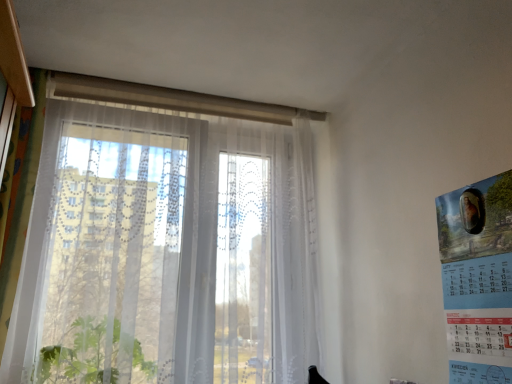
The width and height of the screenshot is (512, 384). Describe the element at coordinates (478, 279) in the screenshot. I see `blue paper calendar at right` at that location.

Where is `blue paper calendar at right`? The height and width of the screenshot is (384, 512). blue paper calendar at right is located at coordinates [x=478, y=279].

I want to click on transparent fabric window at center, so click(167, 251).

The height and width of the screenshot is (384, 512). What do you see at coordinates (167, 251) in the screenshot? I see `transparent fabric window at center` at bounding box center [167, 251].

Looking at this image, what is the approximate width of transparent fabric window at center?

transparent fabric window at center is 28.29 centimeters in width.

Locate an element on the screen. The height and width of the screenshot is (384, 512). blue paper calendar at right is located at coordinates (478, 279).

Considering the positions of objects blue paper calendar at right and transparent fabric window at center in the image provided, who is more to the right, blue paper calendar at right or transparent fabric window at center?

blue paper calendar at right.

Does blue paper calendar at right come in front of transparent fabric window at center?

That is True.

Is point (463, 354) positioned before point (150, 137)?

Yes.

From the image's perspective, between blue paper calendar at right and transparent fabric window at center, which one is located above?

transparent fabric window at center.

In the scene shown: From a real-world perspective, is blue paper calendar at right physically located above or below transparent fabric window at center?

Clearly, from a real-world perspective, blue paper calendar at right is below transparent fabric window at center.

Is blue paper calendar at right wider than transparent fabric window at center?

Incorrect, the width of blue paper calendar at right does not surpass that of transparent fabric window at center.

Considering the sizes of blue paper calendar at right and transparent fabric window at center in the image, is blue paper calendar at right taller or shorter than transparent fabric window at center?

Clearly, blue paper calendar at right is shorter compared to transparent fabric window at center.

Between blue paper calendar at right and transparent fabric window at center, which one has larger size?

With larger size is transparent fabric window at center.

Is blue paper calendar at right not within transparent fabric window at center?

blue paper calendar at right lies outside transparent fabric window at center's area.

Does blue paper calendar at right touch transparent fabric window at center?

No, blue paper calendar at right is not next to transparent fabric window at center.

Looking at this image, is blue paper calendar at right oriented towards transparent fabric window at center?

No, blue paper calendar at right does not turn towards transparent fabric window at center.

The width and height of the screenshot is (512, 384). I want to click on poster page below the transparent fabric window at center (from a real-world perspective), so 478,279.

Can you confirm if transparent fabric window at center is positioned to the right of blue paper calendar at right?

In fact, transparent fabric window at center is to the left of blue paper calendar at right.

Relative to blue paper calendar at right, is transparent fabric window at center in front or behind?

transparent fabric window at center is positioned farther from the viewer than blue paper calendar at right.

Which is behind, point (61, 101) or point (490, 327)?

The point (61, 101) is behind.

From the image's perspective, between transparent fabric window at center and blue paper calendar at right, who is located below?

blue paper calendar at right appears lower in the image.

Consider the image. From a real-world perspective, is transparent fabric window at center below blue paper calendar at right?

No, from a real-world perspective, transparent fabric window at center is not beneath blue paper calendar at right.

Which of these two, transparent fabric window at center or blue paper calendar at right, is wider?

transparent fabric window at center is wider.

From the picture: Is transparent fabric window at center taller or shorter than blue paper calendar at right?

Considering their sizes, transparent fabric window at center has more height than blue paper calendar at right.

Can you confirm if transparent fabric window at center is bigger than blue paper calendar at right?

Indeed, transparent fabric window at center has a larger size compared to blue paper calendar at right.

From the picture: Which is correct: transparent fabric window at center is inside blue paper calendar at right, or outside of it?

transparent fabric window at center is not enclosed by blue paper calendar at right.

Does transparent fabric window at center touch blue paper calendar at right?

No, transparent fabric window at center is not beside blue paper calendar at right.

Is transparent fabric window at center looking in the opposite direction of blue paper calendar at right?

transparent fabric window at center is not turned away from blue paper calendar at right.

How much distance is there between transparent fabric window at center and blue paper calendar at right?

The distance of transparent fabric window at center from blue paper calendar at right is 94.72 centimeters.

Identify the location of window on the left of blue paper calendar at right. (167, 251).

Find the location of `poster page below the transparent fabric window at center (from a real-world perspective)`. poster page below the transparent fabric window at center (from a real-world perspective) is located at coordinates (478, 279).

This screenshot has height=384, width=512. In order to click on window on the left of blue paper calendar at right in this screenshot , I will do `click(167, 251)`.